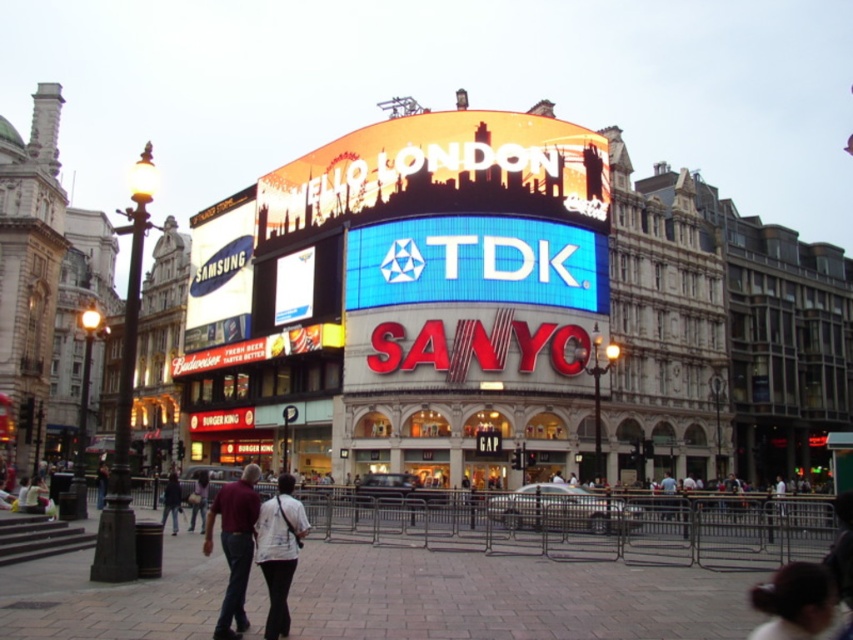
Based on the photo, is white cotton shirt at center positioned in front of dark blue jeans at center?

Yes, it is.

Which is above, white cotton shirt at center or dark blue jeans at center?

Positioned higher is white cotton shirt at center.

Is point (227, 513) farther from viewer compared to point (201, 483)?

No.

This screenshot has height=640, width=853. In order to click on white cotton shirt at center in this screenshot , I will do `click(234, 545)`.

Which is above, matte glass mall at center or dark blue jeans at center?

Positioned higher is matte glass mall at center.

Between matte glass mall at center and dark blue jeans at center, which one has less height?

dark blue jeans at center is shorter.

What do you see at coordinates (500, 312) in the screenshot?
I see `matte glass mall at center` at bounding box center [500, 312].

The image size is (853, 640). Find the location of `matte glass mall at center`. matte glass mall at center is located at coordinates (500, 312).

Which of these two, matte glass mall at center or white fabric shirt at lower center, stands taller?

matte glass mall at center is taller.

Is matte glass mall at center further to camera compared to white fabric shirt at lower center?

Yes, it is.

Does point (366, 454) come closer to viewer compared to point (300, 513)?

No, (366, 454) is behind (300, 513).

Where is `matte glass mall at center`? The image size is (853, 640). matte glass mall at center is located at coordinates (500, 312).